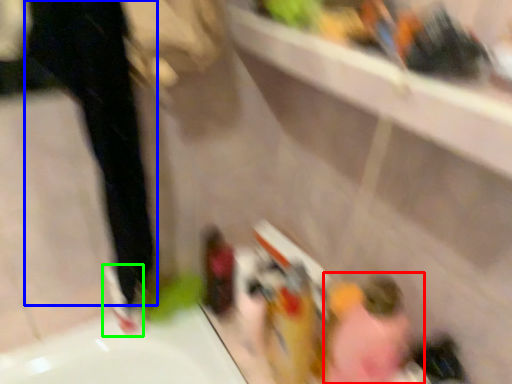
Question: Which object is the farthest from woman (highlighted by a red box)? Choose among these: pants (highlighted by a blue box) or shoe (highlighted by a green box).

Choices:
 (A) pants
 (B) shoe

Answer: (A)